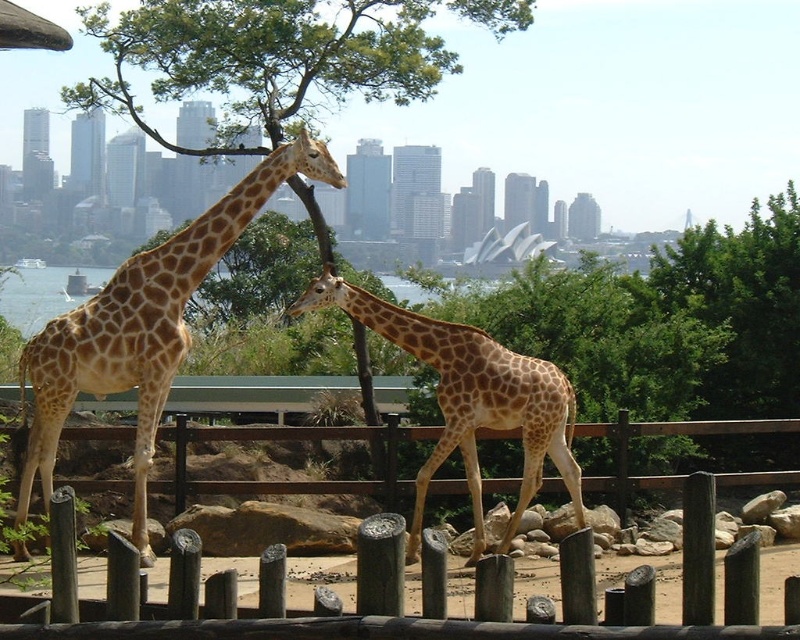
Is point (64, 541) more distant than point (534, 481)?

No, (64, 541) is in front of (534, 481).

This screenshot has height=640, width=800. What do you see at coordinates (398, 589) in the screenshot?
I see `wooden post fence at center` at bounding box center [398, 589].

Find the location of a particular element. The image size is (800, 640). wooden post fence at center is located at coordinates (398, 589).

In order to click on wooden post fence at center in this screenshot , I will do [398, 589].

Can you confirm if wooden post fence at center is thinner than golden-brown spotted giraffe at center?

In fact, wooden post fence at center might be wider than golden-brown spotted giraffe at center.

Which is behind, point (370, 593) or point (324, 173)?

The point (324, 173) is more distant.

Locate an element on the screen. Image resolution: width=800 pixels, height=640 pixels. wooden post fence at center is located at coordinates (398, 589).

Based on the photo, can you confirm if golden-brown spotted giraffe at center is wider than spotted fur giraffe at center?

No, golden-brown spotted giraffe at center is not wider than spotted fur giraffe at center.

Does golden-brown spotted giraffe at center appear under spotted fur giraffe at center?

Incorrect, golden-brown spotted giraffe at center is not positioned below spotted fur giraffe at center.

Image resolution: width=800 pixels, height=640 pixels. Describe the element at coordinates (144, 326) in the screenshot. I see `golden-brown spotted giraffe at center` at that location.

At what (x,y) coordinates should I click in order to perform the action: click on golden-brown spotted giraffe at center. Please return your answer as a coordinate pair (x, y). Looking at the image, I should click on (144, 326).